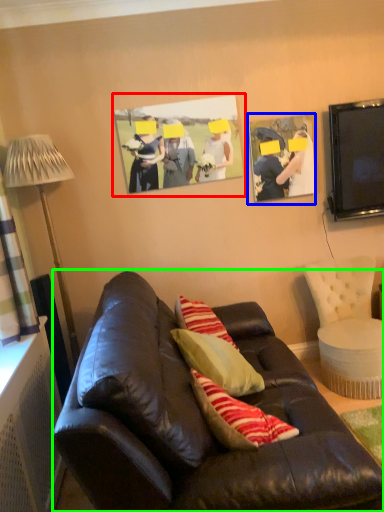
Question: Estimate the real-world distances between objects in this image. Which object is closer to picture frame (highlighted by a red box), picture frame (highlighted by a blue box) or studio couch (highlighted by a green box)?

Choices:
 (A) picture frame
 (B) studio couch

Answer: (A)